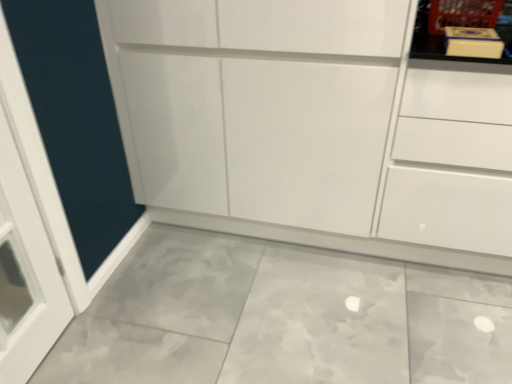
Question: Is the depth of matte yellow book at upper right greater than that of white glossy drawer at upper right?

Choices:
 (A) no
 (B) yes

Answer: (B)

Question: Considering the relative positions of matte yellow book at upper right and white glossy drawer at upper right in the image provided, is matte yellow book at upper right in front of white glossy drawer at upper right?

Choices:
 (A) yes
 (B) no

Answer: (B)

Question: Can you confirm if matte yellow book at upper right is positioned to the left of white glossy drawer at upper right?

Choices:
 (A) yes
 (B) no

Answer: (A)

Question: Can you confirm if matte yellow book at upper right is taller than white glossy drawer at upper right?

Choices:
 (A) yes
 (B) no

Answer: (B)

Question: Are matte yellow book at upper right and white glossy drawer at upper right making contact?

Choices:
 (A) no
 (B) yes

Answer: (A)

Question: Is matte yellow book at upper right bigger than white glossy drawer at upper right?

Choices:
 (A) yes
 (B) no

Answer: (B)

Question: Can you confirm if white glossy cupboard at center is thinner than matte yellow book at upper right?

Choices:
 (A) yes
 (B) no

Answer: (B)

Question: From the image's perspective, would you say white glossy cupboard at center is positioned over matte yellow book at upper right?

Choices:
 (A) yes
 (B) no

Answer: (B)

Question: Considering the relative sizes of white glossy cupboard at center and matte yellow book at upper right in the image provided, is white glossy cupboard at center bigger than matte yellow book at upper right?

Choices:
 (A) yes
 (B) no

Answer: (A)

Question: Is white glossy cupboard at center positioned behind matte yellow book at upper right?

Choices:
 (A) yes
 (B) no

Answer: (B)

Question: Does white glossy cupboard at center have a greater width compared to matte yellow book at upper right?

Choices:
 (A) no
 (B) yes

Answer: (B)

Question: Are white glossy cupboard at center and matte yellow book at upper right located far from each other?

Choices:
 (A) no
 (B) yes

Answer: (A)

Question: Can you confirm if white glossy cupboard at center is shorter than white glossy drawer at upper right?

Choices:
 (A) no
 (B) yes

Answer: (A)